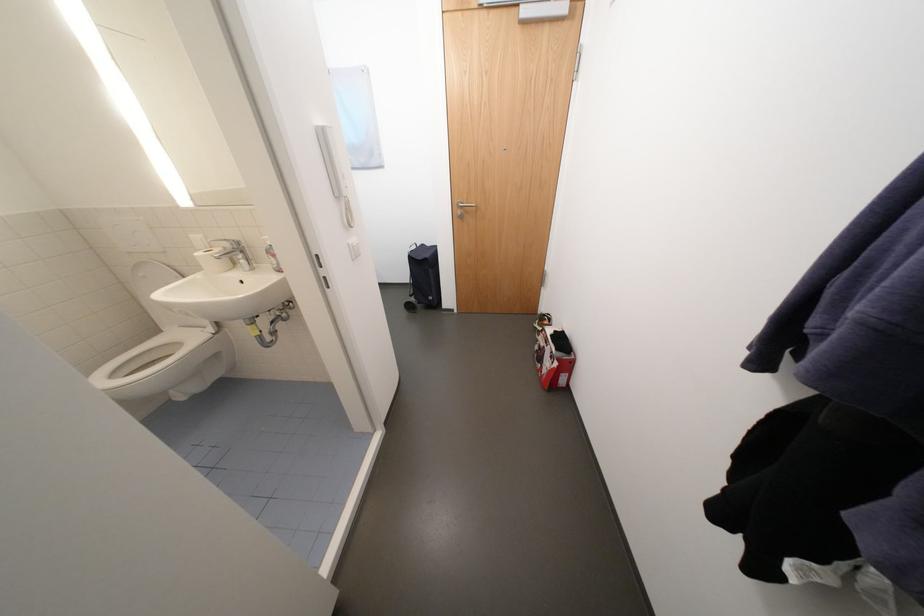
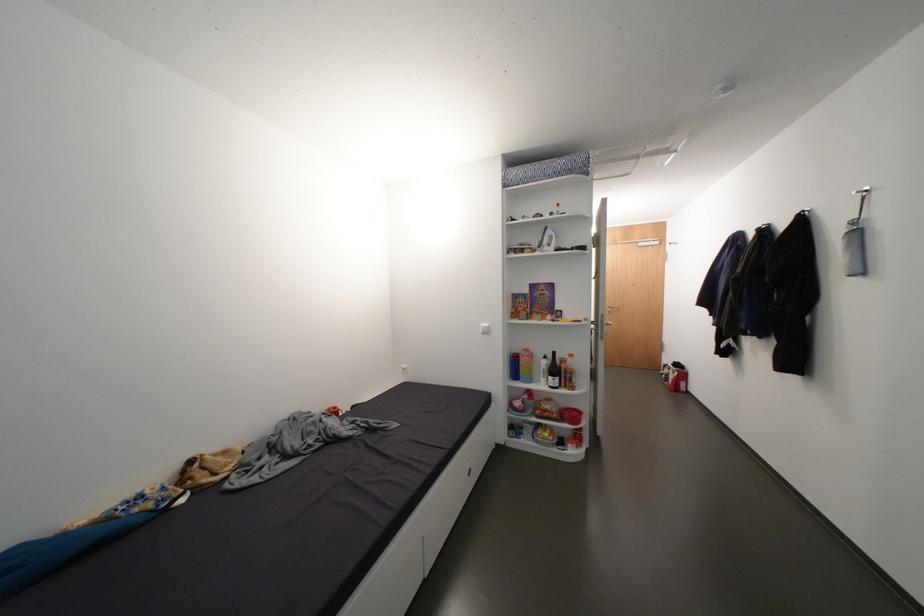
Where in the second image is the point corresponding to point 564,365 from the first image?

(684, 374)